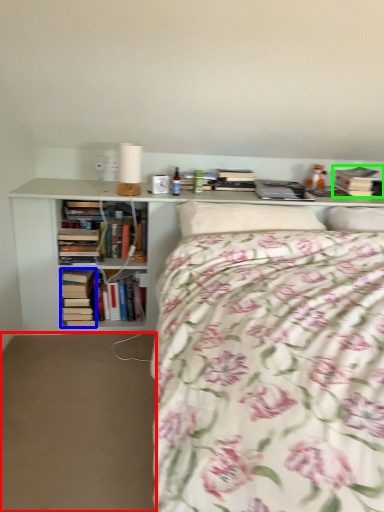
Question: Which is nearer to the plain (highlighted by a red box)? book (highlighted by a blue box) or book (highlighted by a green box).

Choices:
 (A) book
 (B) book

Answer: (A)